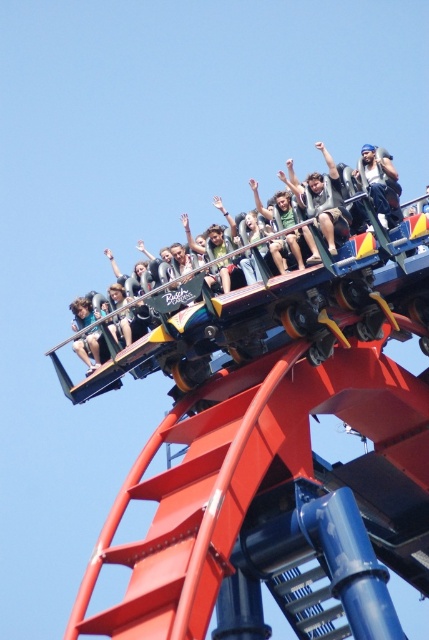
Question: Is black leather jacket at upper center above beige fabric shirt at center?

Choices:
 (A) no
 (B) yes

Answer: (A)

Question: From the image, what is the correct spatial relationship of metallic roller coaster at upper center in relation to black leather jacket at upper center?

Choices:
 (A) below
 (B) above

Answer: (A)

Question: Which is nearer to the metallic roller coaster at upper center?

Choices:
 (A) denim jacket at upper center
 (B) black leather jacket at upper center

Answer: (B)

Question: Which of the following is the farthest from the observer?

Choices:
 (A) metallic roller coaster at upper center
 (B) black leather jacket at upper center
 (C) denim jacket at upper center
 (D) beige fabric shirt at center

Answer: (C)

Question: Is black leather jacket at upper center positioned in front of beige fabric shirt at center?

Choices:
 (A) no
 (B) yes

Answer: (B)

Question: Among these objects, which one is farthest from the camera?

Choices:
 (A) beige fabric shirt at center
 (B) metallic roller coaster at upper center

Answer: (A)